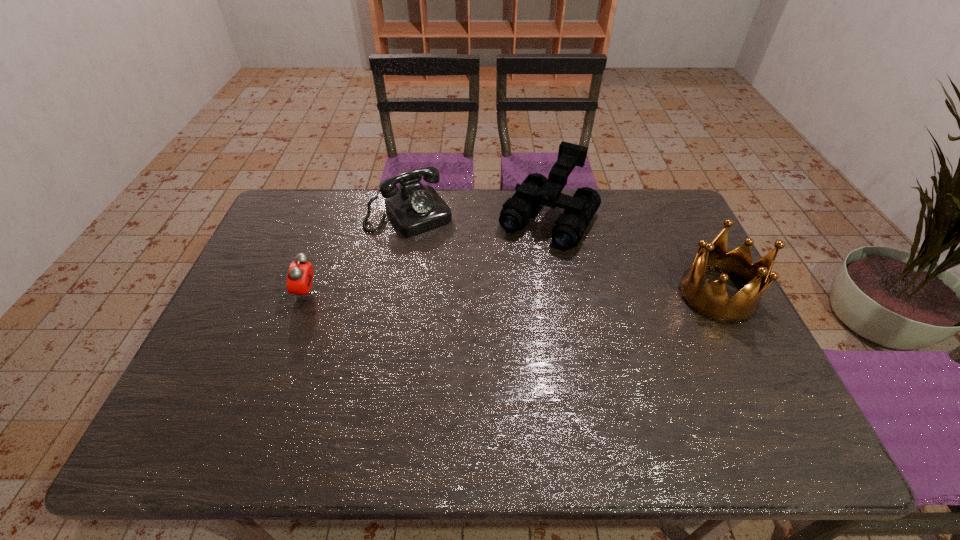
At what (x,y) coordinates should I click in order to perform the action: click on vacant space in between the second object from left to right and the rightmost object. Please return your answer as a coordinate pair (x, y). The width and height of the screenshot is (960, 540). Looking at the image, I should click on (564, 254).

Identify the location of free area in between the third object from left to right and the crown. The width and height of the screenshot is (960, 540). (633, 258).

Point out which object is positioned as the nearest to the second object from right to left. Please provide its 2D coordinates. Your answer should be formatted as a tuple, i.e. [(x, y)], where the tuple contains the x and y coordinates of a point satisfying the conditions above.

[(414, 208)]

Select which object is the closest to the rightmost object. Please provide its 2D coordinates. Your answer should be formatted as a tuple, i.e. [(x, y)], where the tuple contains the x and y coordinates of a point satisfying the conditions above.

[(536, 189)]